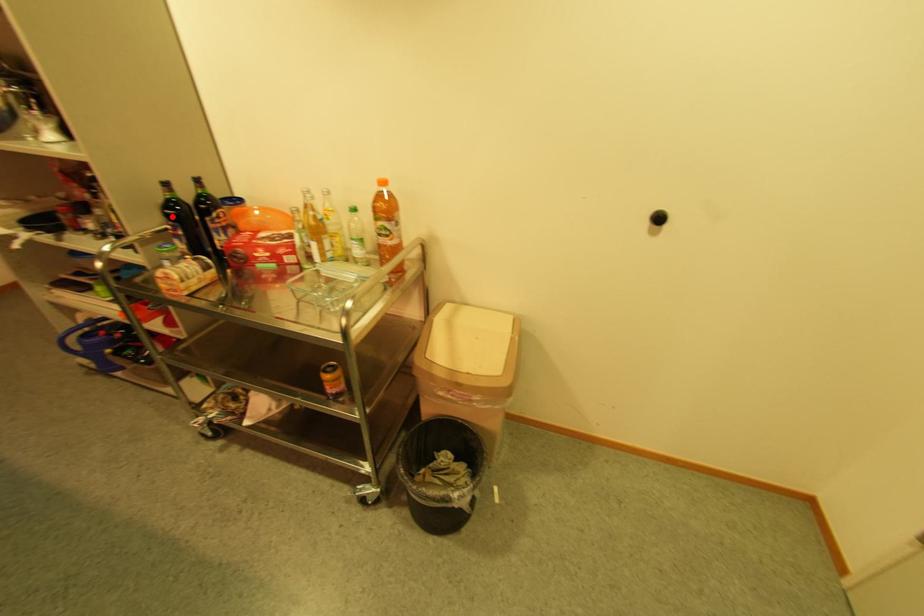
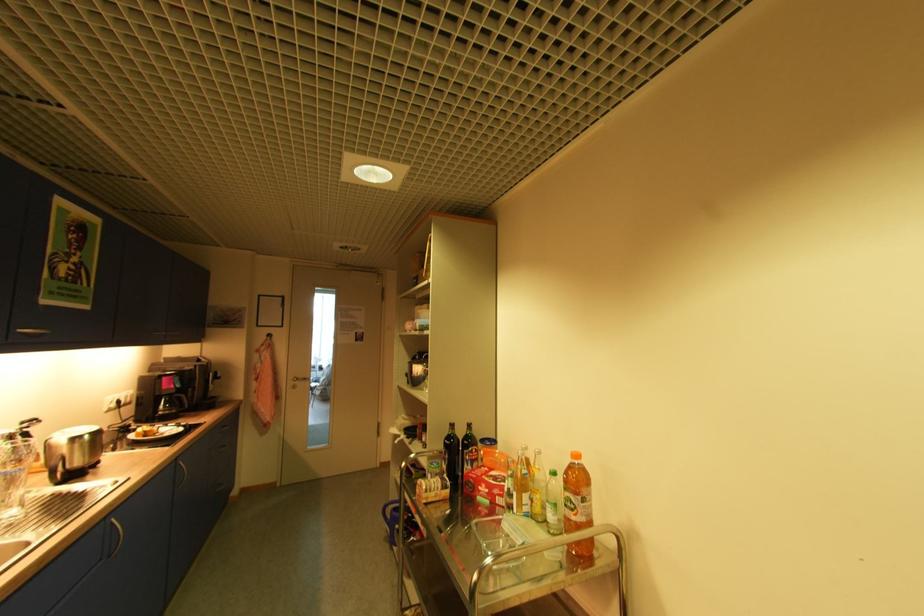
The point at the highlighted location is marked in the first image. Where is the corresponding point in the second image?

(451, 445)